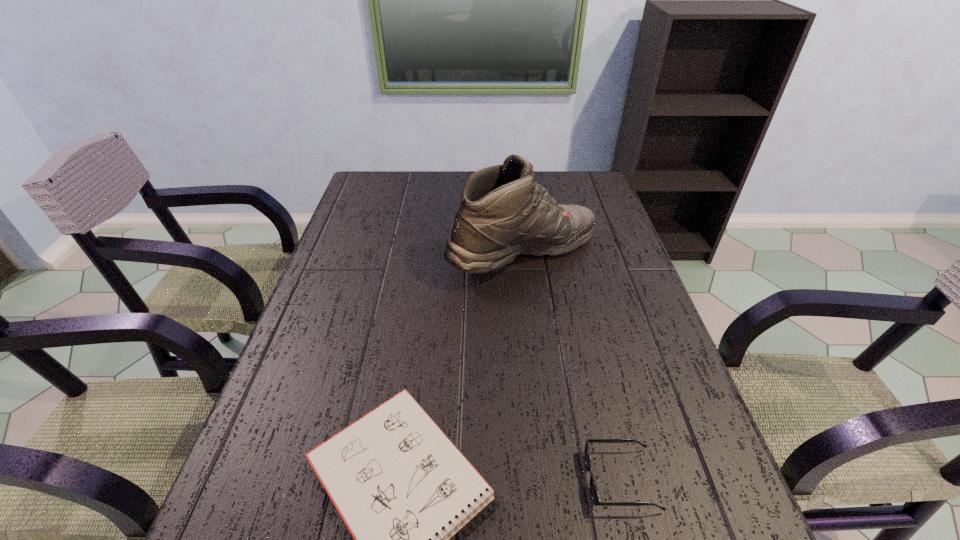
In the image, there is a desktop. Identify the location of free region at the right edge. pos(702,432).

Where is `free space that is in between the sunglasses and the farthest object`? Image resolution: width=960 pixels, height=540 pixels. free space that is in between the sunglasses and the farthest object is located at coordinates (572, 367).

Where is `unoccupied area between the sunglasses and the farthest object`? The image size is (960, 540). unoccupied area between the sunglasses and the farthest object is located at coordinates (572, 367).

This screenshot has height=540, width=960. I want to click on vacant space that is in between the tallest object and the sunglasses, so pyautogui.click(x=572, y=367).

Locate an element on the screen. The height and width of the screenshot is (540, 960). the second closest object relative to the notepad is located at coordinates (503, 213).

Select which object is the second closest to the shortest object. Please provide its 2D coordinates. Your answer should be formatted as a tuple, i.e. [(x, y)], where the tuple contains the x and y coordinates of a point satisfying the conditions above.

[(503, 213)]